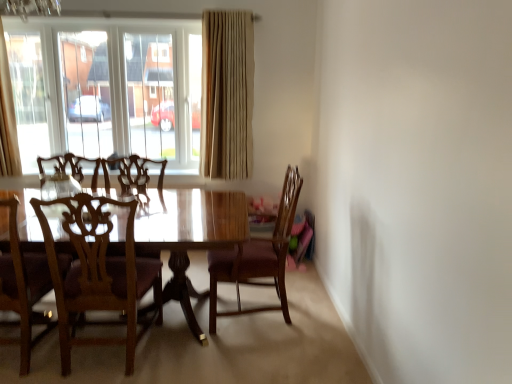
Question: Is wooden chair at center, which appears as the 1th chair when viewed from the right, inside wooden chair at left, arranged as the 3th chair when viewed from the right?

Choices:
 (A) yes
 (B) no

Answer: (B)

Question: Is wooden chair at left, the 1th chair from the left, looking in the opposite direction of wooden chair at center, which ranks as the third chair in left-to-right order?

Choices:
 (A) no
 (B) yes

Answer: (A)

Question: Does wooden chair at left, arranged as the 3th chair when viewed from the right, have a greater width compared to wooden chair at center, which appears as the 1th chair when viewed from the right?

Choices:
 (A) yes
 (B) no

Answer: (B)

Question: From a real-world perspective, is wooden chair at left, the 1th chair from the left, on wooden chair at center, which appears as the 1th chair when viewed from the right?

Choices:
 (A) no
 (B) yes

Answer: (A)

Question: From the image's perspective, would you say wooden chair at left, arranged as the 3th chair when viewed from the right, is shown under wooden chair at center, which appears as the 1th chair when viewed from the right?

Choices:
 (A) yes
 (B) no

Answer: (A)

Question: From a real-world perspective, is wooden chair at center, which appears as the 1th chair when viewed from the right, positioned above or below transparent glass window at upper left?

Choices:
 (A) above
 (B) below

Answer: (B)

Question: Relative to transparent glass window at upper left, is wooden chair at center, which ranks as the third chair in left-to-right order, in front or behind?

Choices:
 (A) front
 (B) behind

Answer: (A)

Question: Is wooden chair at center, which appears as the 1th chair when viewed from the right, wider or thinner than transparent glass window at upper left?

Choices:
 (A) wide
 (B) thin

Answer: (A)

Question: Is point (237, 259) closer or farther from the camera than point (50, 114)?

Choices:
 (A) closer
 (B) farther

Answer: (A)

Question: Considering the positions of point (28, 327) and point (158, 319), is point (28, 327) closer or farther from the camera than point (158, 319)?

Choices:
 (A) closer
 (B) farther

Answer: (A)

Question: From the image's perspective, is wooden chair at left, the 1th chair from the left, above or below wooden chair at left, placed as the 2th chair when sorted from left to right?

Choices:
 (A) above
 (B) below

Answer: (B)

Question: Looking at their shapes, would you say wooden chair at left, arranged as the 3th chair when viewed from the right, is wider or thinner than wooden chair at left, placed as the 2th chair when sorted from left to right?

Choices:
 (A) thin
 (B) wide

Answer: (A)

Question: Which is correct: wooden chair at left, the 1th chair from the left, is inside wooden chair at left, which is the 2th chair from right to left, or outside of it?

Choices:
 (A) outside
 (B) inside

Answer: (A)

Question: From the image's perspective, relative to wooden chair at center, which appears as the 1th chair when viewed from the right, is transparent glass window at upper left above or below?

Choices:
 (A) above
 (B) below

Answer: (A)

Question: Relative to wooden chair at center, which appears as the 1th chair when viewed from the right, is transparent glass window at upper left in front or behind?

Choices:
 (A) front
 (B) behind

Answer: (B)